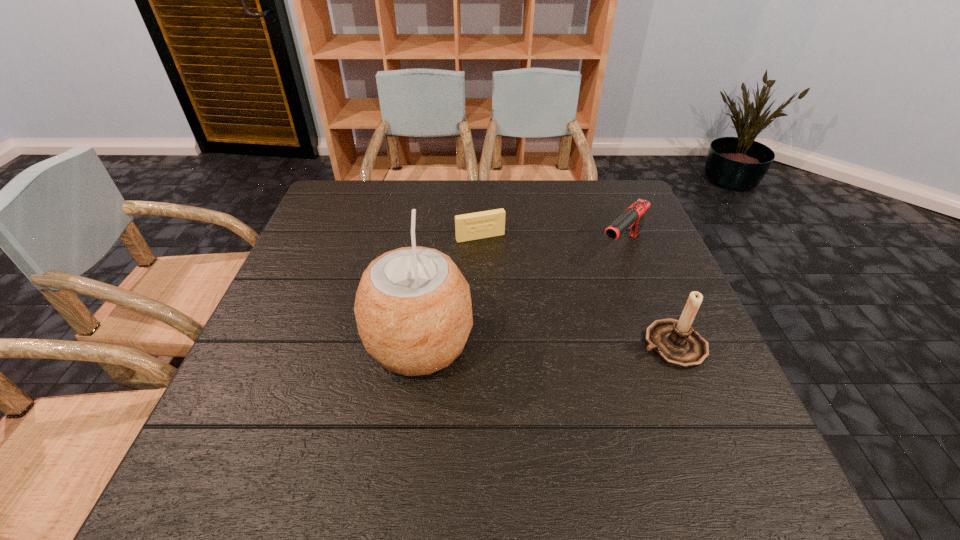
Identify the location of vacant space positioned at the aiming end of the third tallest object. (546, 325).

Where is `free point located 0.230m at the aiming end of the third tallest object`? This screenshot has width=960, height=540. free point located 0.230m at the aiming end of the third tallest object is located at coordinates (559, 313).

Find the location of a particular element. Image resolution: width=960 pixels, height=540 pixels. candle holder located in the right edge section of the desktop is located at coordinates (675, 342).

The width and height of the screenshot is (960, 540). Find the location of `gun at the right edge`. gun at the right edge is located at coordinates (633, 217).

In the image, there is a desktop. What are the coordinates of `vacant space at the far edge` in the screenshot? It's located at (478, 185).

Locate an element on the screen. This screenshot has height=540, width=960. free region at the near edge of the desktop is located at coordinates (496, 395).

This screenshot has width=960, height=540. Find the location of `blank space at the left edge`. blank space at the left edge is located at coordinates (294, 381).

Where is `vacant position at the right edge of the desktop`? This screenshot has width=960, height=540. vacant position at the right edge of the desktop is located at coordinates (666, 297).

Where is `vacant area at the far left corner`? vacant area at the far left corner is located at coordinates (341, 191).

Where is `unoccupied area between the videotape and the second tallest object`? The width and height of the screenshot is (960, 540). unoccupied area between the videotape and the second tallest object is located at coordinates (576, 291).